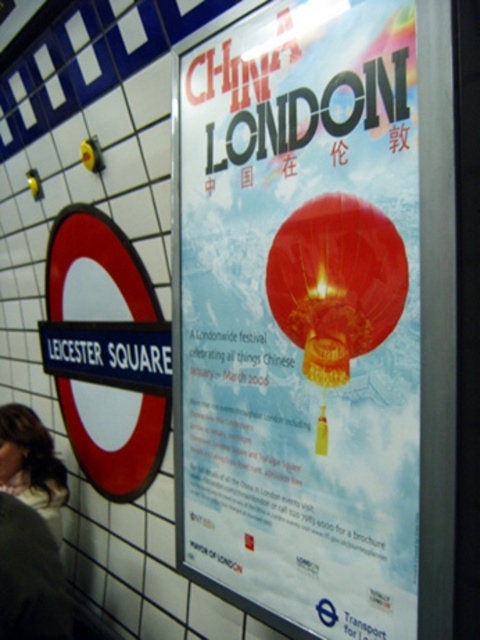
Question: Can you confirm if matte red poster at upper right is smaller than metallic round sign at left?

Choices:
 (A) yes
 (B) no

Answer: (A)

Question: Does metallic round sign at left have a smaller size compared to blonde hair at lower left?

Choices:
 (A) no
 (B) yes

Answer: (A)

Question: Which of these objects is positioned farthest from the matte red poster at upper right?

Choices:
 (A) metallic round sign at left
 (B) blonde hair at lower left

Answer: (B)

Question: Does metallic round sign at left have a smaller size compared to blonde hair at lower left?

Choices:
 (A) no
 (B) yes

Answer: (A)

Question: Which of the following is the farthest from the observer?

Choices:
 (A) (122, 488)
 (B) (350, 456)

Answer: (A)

Question: Considering the real-world distances, which object is farthest from the metallic round sign at left?

Choices:
 (A) matte red poster at upper right
 (B) blonde hair at lower left

Answer: (A)